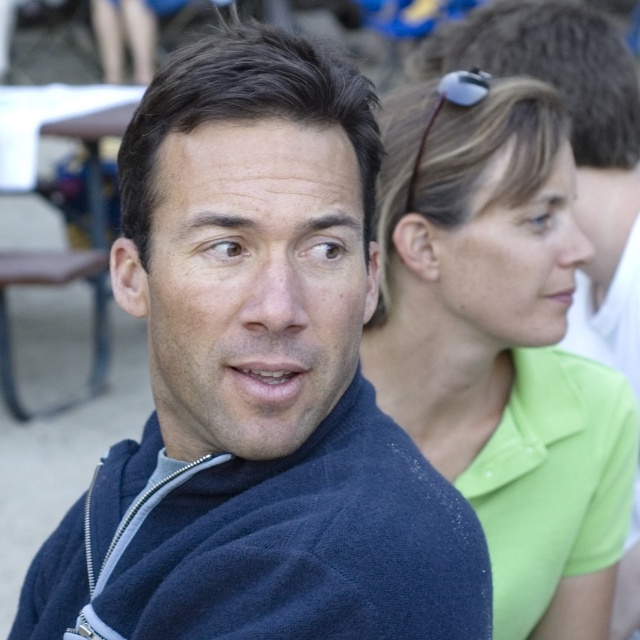
Question: Is green matte shirt at upper right above matte green shirt at upper right?

Choices:
 (A) yes
 (B) no

Answer: (B)

Question: Estimate the real-world distances between objects in this image. Which object is closer to the matte blue face at center?

Choices:
 (A) green matte shirt at upper right
 (B) matte green shirt at upper right
 (C) dark blue fleece sweatshirt at center
 (D) matte blue sweater at center

Answer: (D)

Question: Which of the following is the closest to the observer?

Choices:
 (A) (257, 529)
 (B) (563, 532)

Answer: (A)

Question: Can you confirm if matte blue sweater at center is thinner than green matte shirt at upper right?

Choices:
 (A) yes
 (B) no

Answer: (B)

Question: Is green matte shirt at upper right to the right of matte green shirt at upper right from the viewer's perspective?

Choices:
 (A) no
 (B) yes

Answer: (B)

Question: Which point is farther to the camera?

Choices:
 (A) (560, 396)
 (B) (305, 266)
 (C) (282, 609)

Answer: (A)